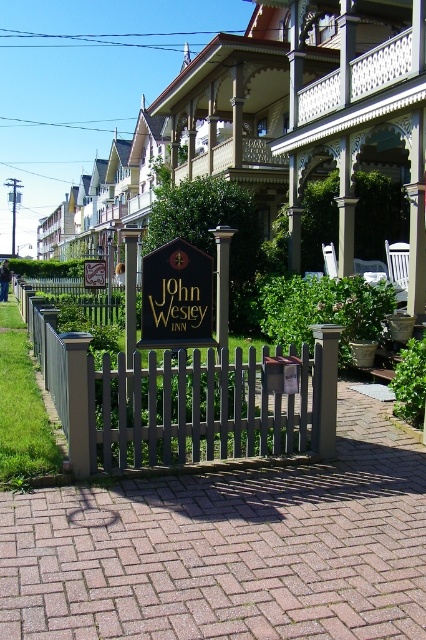
Question: Which of the following is the farthest from the observer?

Choices:
 (A) black wood sign at center
 (B) goldmaterial/texturesign at center

Answer: (B)

Question: Can you confirm if black wood sign at center is positioned to the left of goldmaterial/texturesign at center?

Choices:
 (A) yes
 (B) no

Answer: (B)

Question: Which point is farther to the camera?

Choices:
 (A) (89, 268)
 (B) (86, 369)
 (C) (34, 330)

Answer: (A)

Question: Does gray wood picket fence at center appear on the right side of black wood sign at center?

Choices:
 (A) yes
 (B) no

Answer: (B)

Question: Does brown wood post at center have a greater width compared to goldmaterial/texturesign at center?

Choices:
 (A) yes
 (B) no

Answer: (B)

Question: Among these objects, which one is farthest from the camera?

Choices:
 (A) goldmaterial/texturesign at center
 (B) gray wood picket fence at center

Answer: (A)